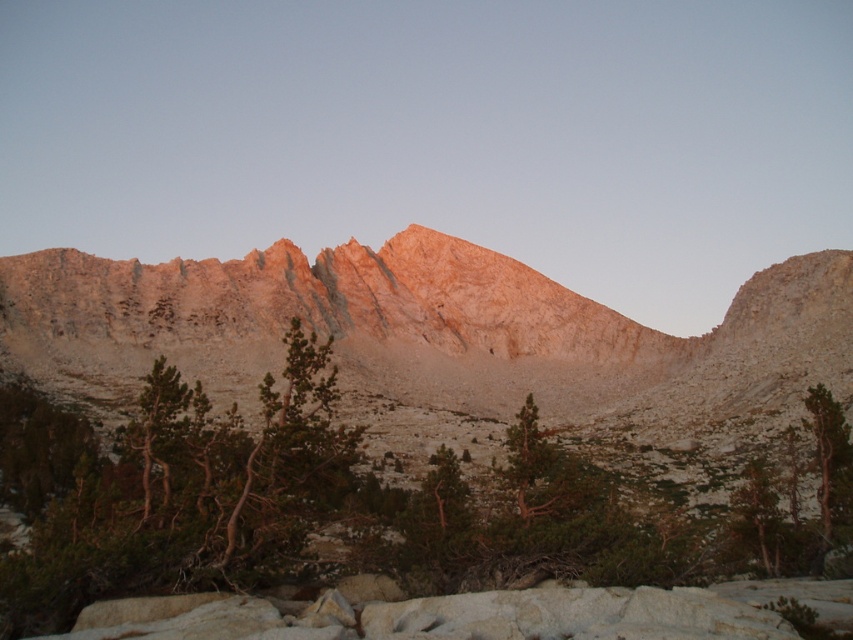
You are a hiker planning to take a photo of the sunset with both the green textured tree at center and the green textured tree at right in the frame. Based on their positions, which tree should you place closer to the left side of your camera view to include both in the photo?

The green textured tree at center is positioned on the left side of the green textured tree at right, so to include both in the photo, you should place the green textured tree at center closer to the left side of your camera view.

You are a hiker planning to set up a tent in the mountain area shown in the image. You have a tent that requires a space wider than the green textured tree at right. Can you use the area near the green textured tree at center for your tent?

The green textured tree at center is wider than the green textured tree at right, so the area near the green textured tree at center may provide sufficient space for your tent if its width meets or exceeds the required width.